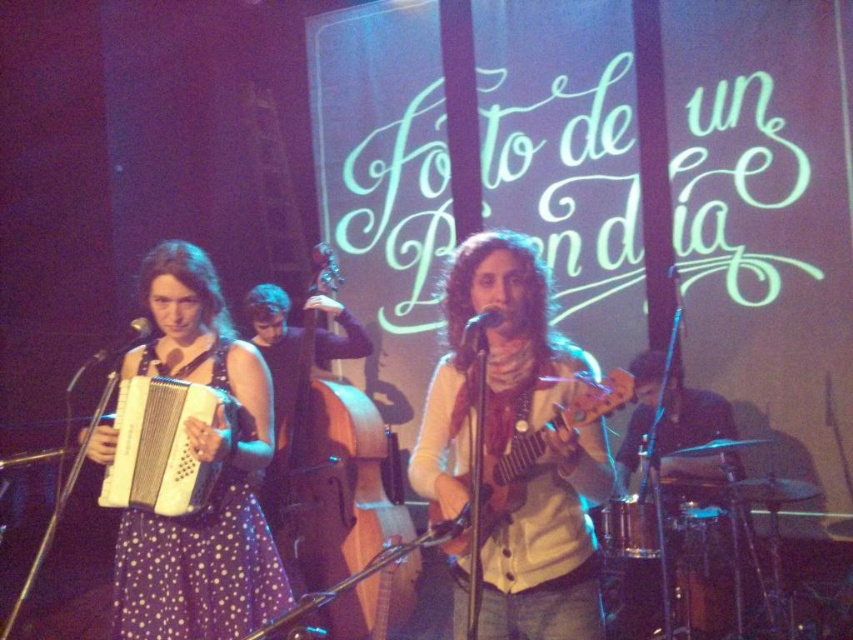
You are a photographer positioned at the center of the venue. You want to capture a closeup shot of the matte white accordion at left. Based on its coordinates, is it positioned to your left or right side?

The matte white accordion at left is located at point 0.691 on the x axis and 0.195 on the y axis. Since the x coordinate is greater than 0.5, it is positioned to your right side.

You are a photographer in the audience of this live music performance. You want to capture a photo where both the purple dotted dress at left and the wooden cello at center are visible. Considering their heights, which object will appear smaller in the photo?

The purple dotted dress at left will appear smaller in the photo because it has a lesser height compared to the wooden cello at center.